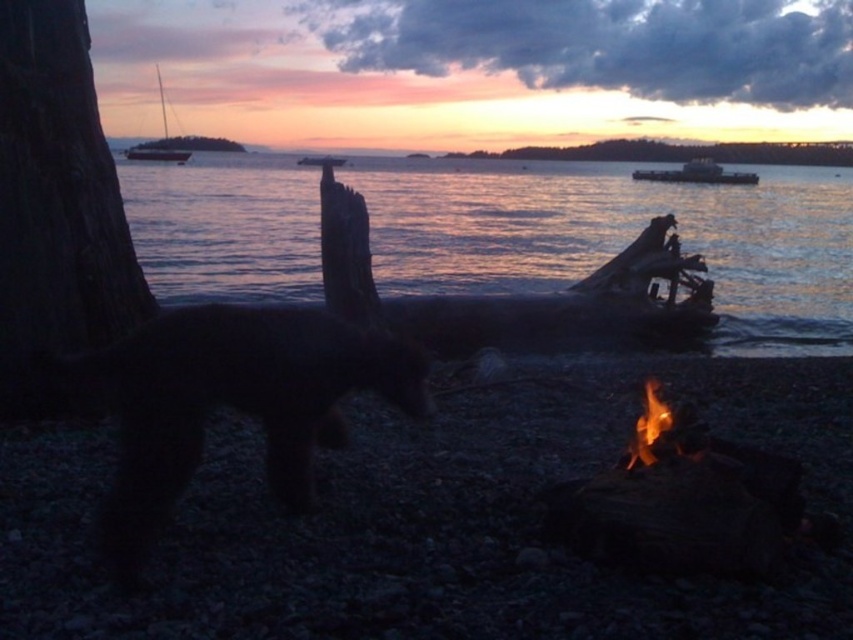
Question: Does charcoal gray pebbles at lower right have a larger size compared to smooth water at center?

Choices:
 (A) no
 (B) yes

Answer: (A)

Question: Among these points, which one is nearest to the camera?

Choices:
 (A) (444, 547)
 (B) (682, 172)

Answer: (A)

Question: Is flamematerial/texture at right positioned behind metallic silver boat at upper center?

Choices:
 (A) yes
 (B) no

Answer: (B)

Question: Is smooth water at center above smooth bark log at upper center?

Choices:
 (A) yes
 (B) no

Answer: (B)

Question: Which point is farther to the camera?

Choices:
 (A) charcoal gray pebbles at lower right
 (B) metallic silver boat at center
 (C) white sailboat at upper left

Answer: (C)

Question: Which of these objects is positioned closest to the white sailboat at upper left?

Choices:
 (A) smooth water at center
 (B) dark brown wood at left

Answer: (A)